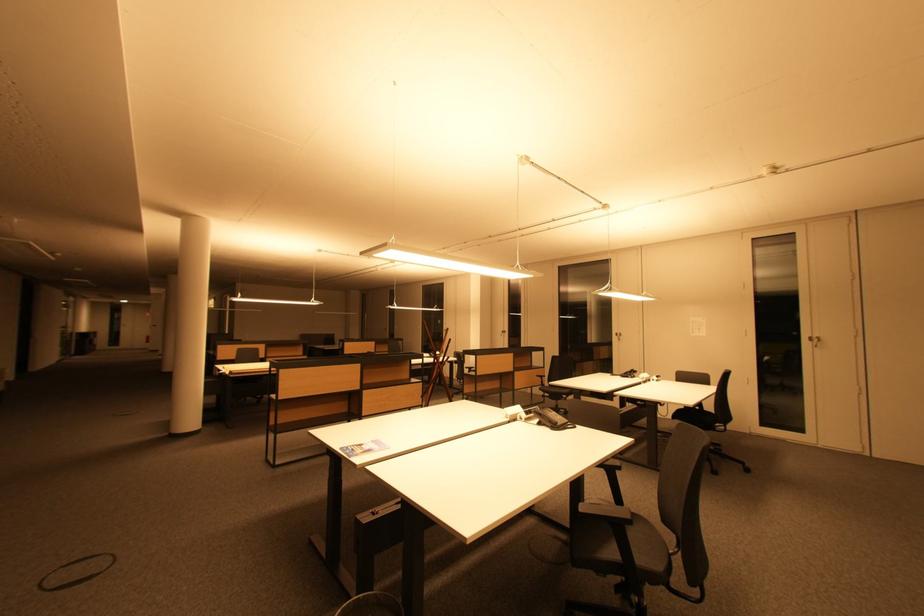
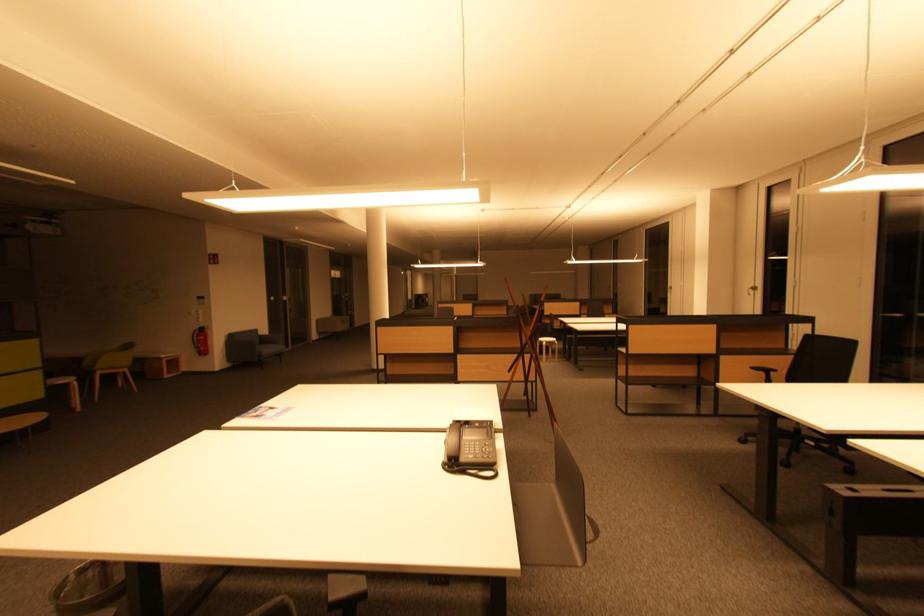
The point at (x=543, y=381) is marked in the first image. Where is the corresponding point in the second image?

(767, 376)